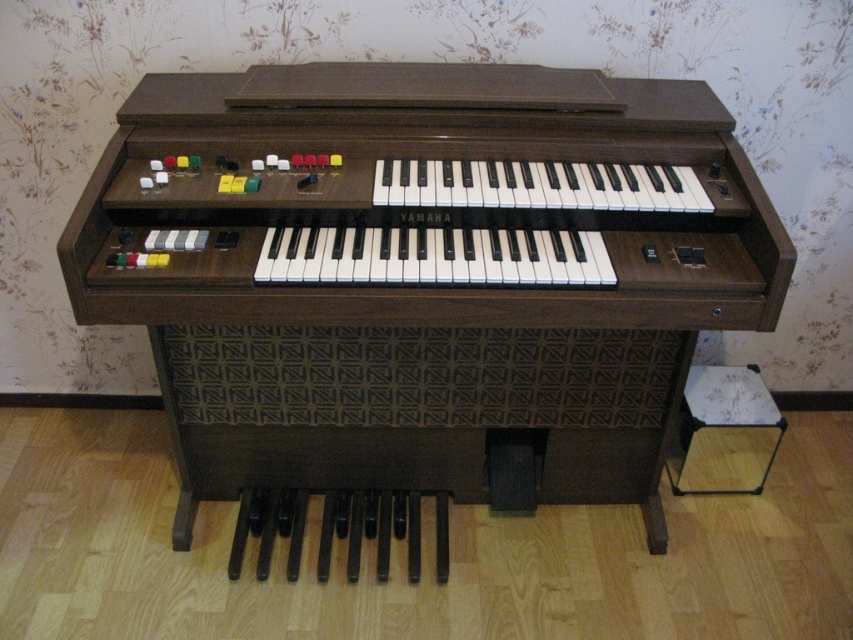
Is point (297, 516) in front of point (689, 396)?

That is True.

Who is more distant from viewer, (355, 204) or (697, 412)?

The point (697, 412) is behind.

Does point (370, 410) come behind point (746, 412)?

No, it is not.

Identify the location of wooden piano at center. The width and height of the screenshot is (853, 640). (422, 284).